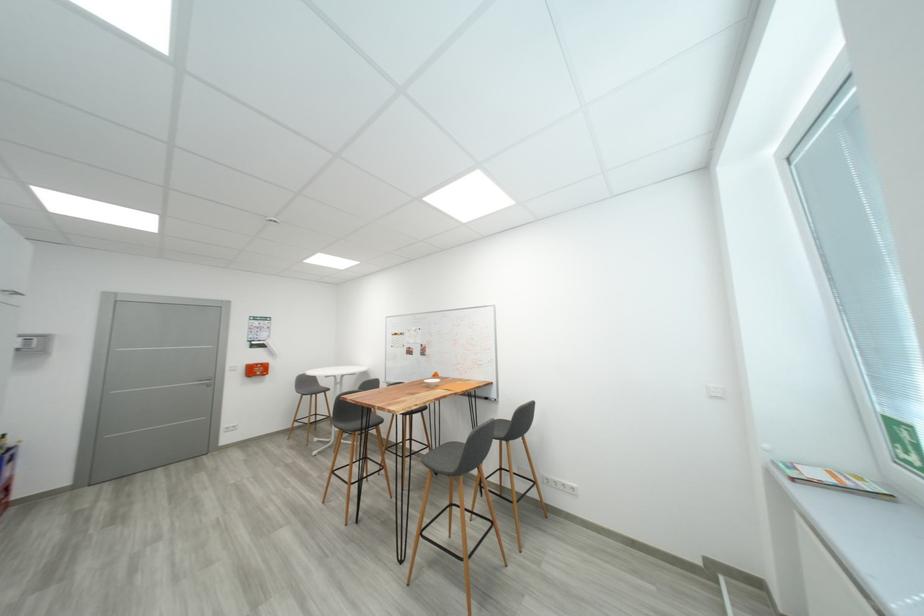
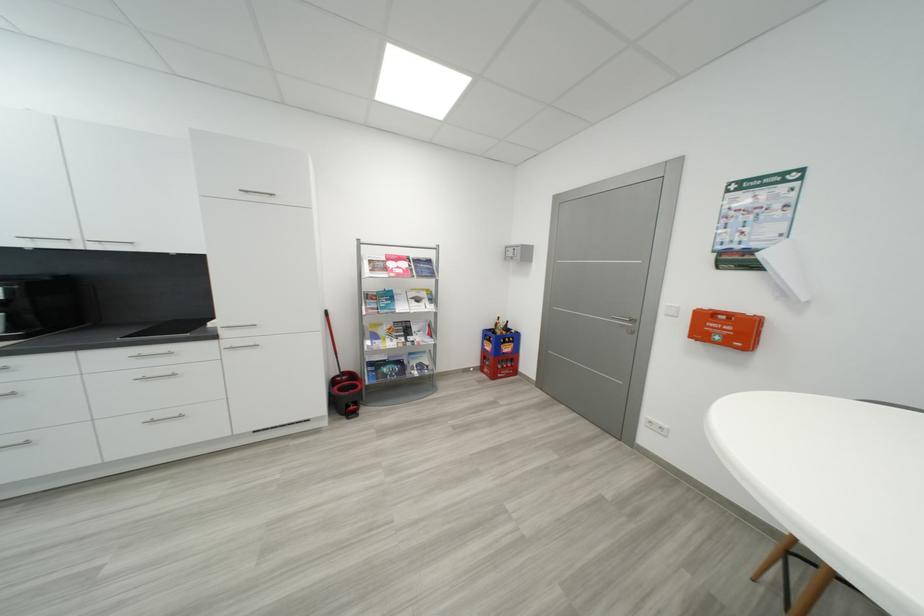
Find the pixel in the second image that matches point 263,373 in the first image.

(733, 333)